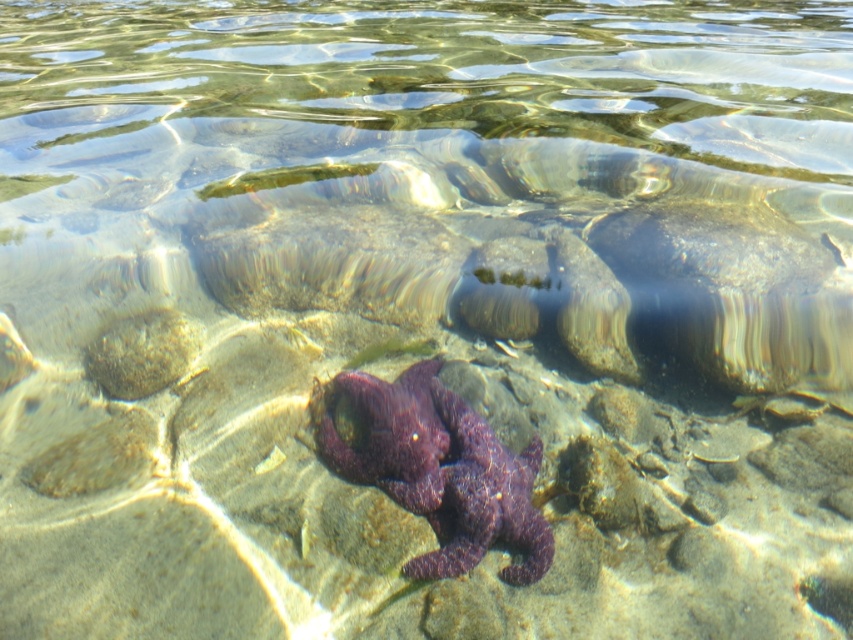
Between purple rough starfish at center and smooth brown rock at lower left, which one is positioned lower?

Positioned lower is purple rough starfish at center.

Is purple rough starfish at center bigger than smooth brown rock at lower left?

Yes, purple rough starfish at center is bigger than smooth brown rock at lower left.

Identify the location of purple rough starfish at center. (482, 500).

Which is more to the right, purple matte starfish at center or smooth brown rock at lower left?

From the viewer's perspective, purple matte starfish at center appears more on the right side.

Can you confirm if purple matte starfish at center is bigger than smooth brown rock at lower left?

Yes, purple matte starfish at center is bigger than smooth brown rock at lower left.

Identify the location of purple matte starfish at center. The height and width of the screenshot is (640, 853). pos(389,433).

Between purple rough starfish at center and purple matte starfish at center, which one is positioned higher?

purple matte starfish at center is higher up.

Does point (421, 486) lie in front of point (390, 422)?

Yes.

At what (x,y) coordinates should I click in order to perform the action: click on purple rough starfish at center. Please return your answer as a coordinate pair (x, y). Looking at the image, I should click on (482, 500).